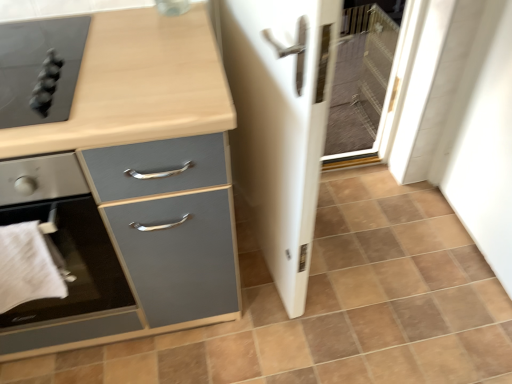
Question: Can you confirm if white cloth at lower left is shorter than matte black cooktop at upper left, acting as the 1th home appliance starting from the top?

Choices:
 (A) yes
 (B) no

Answer: (B)

Question: Are white cloth at lower left and matte black cooktop at upper left, the second home appliance ordered from the bottom, located far from each other?

Choices:
 (A) yes
 (B) no

Answer: (B)

Question: Is white cloth at lower left not within matte black cooktop at upper left, acting as the 1th home appliance starting from the top?

Choices:
 (A) no
 (B) yes

Answer: (B)

Question: Considering the relative sizes of white cloth at lower left and matte black cooktop at upper left, the second home appliance ordered from the bottom, in the image provided, is white cloth at lower left smaller than matte black cooktop at upper left, the second home appliance ordered from the bottom,?

Choices:
 (A) yes
 (B) no

Answer: (A)

Question: Does white cloth at lower left touch matte black cooktop at upper left, acting as the 1th home appliance starting from the top?

Choices:
 (A) yes
 (B) no

Answer: (B)

Question: Is white cloth at lower left positioned behind matte black cooktop at upper left, the second home appliance ordered from the bottom?

Choices:
 (A) no
 (B) yes

Answer: (A)

Question: From the image's perspective, would you say matte black cooktop at upper left, the second home appliance ordered from the bottom, is positioned over brown matte tile at center?

Choices:
 (A) yes
 (B) no

Answer: (A)

Question: Is matte black cooktop at upper left, the second home appliance ordered from the bottom, taller than brown matte tile at center?

Choices:
 (A) yes
 (B) no

Answer: (A)

Question: Is matte black cooktop at upper left, the second home appliance ordered from the bottom, outside brown matte tile at center?

Choices:
 (A) yes
 (B) no

Answer: (A)

Question: Is matte black cooktop at upper left, acting as the 1th home appliance starting from the top, shorter than brown matte tile at center?

Choices:
 (A) no
 (B) yes

Answer: (A)

Question: Is matte black cooktop at upper left, acting as the 1th home appliance starting from the top, aimed at brown matte tile at center?

Choices:
 (A) yes
 (B) no

Answer: (B)

Question: Does matte black cooktop at upper left, the second home appliance ordered from the bottom, have a greater width compared to brown matte tile at center?

Choices:
 (A) no
 (B) yes

Answer: (A)

Question: Is white glossy screen door at center outside matte black cooktop at upper left, acting as the 1th home appliance starting from the top?

Choices:
 (A) no
 (B) yes

Answer: (B)